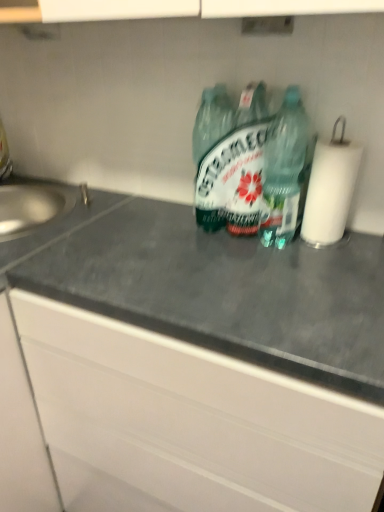
Where is `green glass bottle at center, positioned as the 1th bottle in left-to-right order`? green glass bottle at center, positioned as the 1th bottle in left-to-right order is located at coordinates (262, 174).

In order to face gray matte countertop at center, should I rotate leftwards or rightwards?

Turn right approximately 4.121 degrees to face it.

At what (x,y) coordinates should I click in order to perform the action: click on gray matte countertop at center. Please return your answer as a coordinate pair (x, y). This screenshot has width=384, height=512. Looking at the image, I should click on (217, 288).

You are a GUI agent. You are given a task and a screenshot of the screen. Output one action in this format:
    pyautogui.click(x=<x>, y=<y>)
    Task: Click on the satin silver sink at left
    The height and width of the screenshot is (512, 384).
    Given the screenshot: What is the action you would take?
    pyautogui.click(x=34, y=206)

From the image's perspective, which one is positioned higher, white paper at right or satin silver sink at left?

white paper at right is shown above in the image.

Could you tell me if white paper at right is facing satin silver sink at left?

No, white paper at right does not turn towards satin silver sink at left.

In terms of width, does white paper at right look wider or thinner when compared to satin silver sink at left?

Considering their sizes, white paper at right looks slimmer than satin silver sink at left.

Does gray matte countertop at center have a greater width compared to satin silver sink at left?

Indeed, gray matte countertop at center has a greater width compared to satin silver sink at left.

Is gray matte countertop at center oriented towards satin silver sink at left?

No.

In the scene shown: Is gray matte countertop at center taller or shorter than satin silver sink at left?

In the image, gray matte countertop at center appears to be taller than satin silver sink at left.

Is gray matte countertop at center in contact with satin silver sink at left?

There is a gap between gray matte countertop at center and satin silver sink at left.

Locate an element on the screen. The image size is (384, 512). bottle that is the 1st object located above the gray matte countertop at center (from the image's perspective) is located at coordinates (284, 170).

What's the angular difference between gray matte countertop at center and green translucent bottle at center, which appears as the second bottle when viewed from the left,'s facing directions?

They differ by 0.978 degrees in their facing directions.

In the scene shown: Could you tell me if gray matte countertop at center is facing green translucent bottle at center, which appears as the second bottle when viewed from the left?

No, gray matte countertop at center is not turned towards green translucent bottle at center, which appears as the second bottle when viewed from the left.

From a real-world perspective, which is physically above, green translucent bottle at center, which is the 1th bottle from right to left, or white paper at right?

From a 3D spatial view, green translucent bottle at center, which is the 1th bottle from right to left, is above.

Is green translucent bottle at center, which is the 1th bottle from right to left, at the left side of white paper at right?

Indeed, green translucent bottle at center, which is the 1th bottle from right to left, is positioned on the left side of white paper at right.

Are green translucent bottle at center, which appears as the second bottle when viewed from the left, and white paper at right making contact?

Yes.

Is green translucent bottle at center, which appears as the second bottle when viewed from the left, behind white paper at right?

No.

What are the coordinates of `bottle in front of the green glass bottle at center, positioned as the 1th bottle in left-to-right order` in the screenshot? It's located at (284, 170).

Do you think green glass bottle at center, which is the second bottle in right-to-left order, is within green translucent bottle at center, which appears as the second bottle when viewed from the left, or outside of it?

A: green glass bottle at center, which is the second bottle in right-to-left order, is not inside green translucent bottle at center, which appears as the second bottle when viewed from the left, it's outside.

From a real-world perspective, is green glass bottle at center, which is the second bottle in right-to-left order, positioned above or below green translucent bottle at center, which is the 1th bottle from right to left?

Clearly, from a real-world perspective, green glass bottle at center, which is the second bottle in right-to-left order, is above green translucent bottle at center, which is the 1th bottle from right to left.

From the image's perspective, between green glass bottle at center, which is the second bottle in right-to-left order, and green translucent bottle at center, which appears as the second bottle when viewed from the left, which one is located above?

green glass bottle at center, which is the second bottle in right-to-left order, from the image's perspective.

Is white paper at right wider than green translucent bottle at center, which is the 1th bottle from right to left?

Correct, the width of white paper at right exceeds that of green translucent bottle at center, which is the 1th bottle from right to left.

From a real-world perspective, is white paper at right located beneath green translucent bottle at center, which appears as the second bottle when viewed from the left?

Yes, from a real-world perspective, white paper at right is under green translucent bottle at center, which appears as the second bottle when viewed from the left.

How different are the orientations of white paper at right and green translucent bottle at center, which appears as the second bottle when viewed from the left, in degrees?

4.68 degrees.

Can you see white paper at right touching green translucent bottle at center, which is the 1th bottle from right to left?

Yes, white paper at right is right next to green translucent bottle at center, which is the 1th bottle from right to left, and making contact.

In the scene shown: From the image's perspective, which one is positioned higher, white paper at right or green glass bottle at center, which is the second bottle in right-to-left order?

green glass bottle at center, which is the second bottle in right-to-left order.

Does white paper at right have a larger size compared to green glass bottle at center, which is the second bottle in right-to-left order?

No, white paper at right is not bigger than green glass bottle at center, which is the second bottle in right-to-left order.

Does white paper at right turn towards green glass bottle at center, which is the second bottle in right-to-left order?

No, white paper at right is not facing towards green glass bottle at center, which is the second bottle in right-to-left order.

Locate an element on the screen. The width and height of the screenshot is (384, 512). paper towel on the right side of satin silver sink at left is located at coordinates (330, 188).

Where is `counter top that appears below the satin silver sink at left (from a real-world perspective)`? The height and width of the screenshot is (512, 384). counter top that appears below the satin silver sink at left (from a real-world perspective) is located at coordinates (217, 288).

Estimate the real-world distances between objects in this image. Which object is closer to satin silver sink at left, green translucent bottle at center, which appears as the second bottle when viewed from the left, or green glass bottle at center, which is the second bottle in right-to-left order?

green glass bottle at center, which is the second bottle in right-to-left order, lies closer to satin silver sink at left than the other object.

When comparing their distances from green translucent bottle at center, which appears as the second bottle when viewed from the left, does gray matte countertop at center or green glass bottle at center, positioned as the 1th bottle in left-to-right order, seem closer?

Based on the image, green glass bottle at center, positioned as the 1th bottle in left-to-right order, appears to be nearer to green translucent bottle at center, which appears as the second bottle when viewed from the left.

Based on their spatial positions, is satin silver sink at left or green translucent bottle at center, which appears as the second bottle when viewed from the left, further from gray matte countertop at center?

satin silver sink at left is positioned further to the anchor gray matte countertop at center.

Estimate the real-world distances between objects in this image. Which object is further from green translucent bottle at center, which is the 1th bottle from right to left, white paper at right or satin silver sink at left?

satin silver sink at left lies further to green translucent bottle at center, which is the 1th bottle from right to left, than the other object.

Which object lies further to the anchor point green glass bottle at center, positioned as the 1th bottle in left-to-right order, green translucent bottle at center, which is the 1th bottle from right to left, or satin silver sink at left?

satin silver sink at left is positioned further to the anchor green glass bottle at center, positioned as the 1th bottle in left-to-right order.

Considering their positions, is satin silver sink at left positioned closer to green translucent bottle at center, which is the 1th bottle from right to left, than white paper at right?

white paper at right.

When comparing their distances from green glass bottle at center, positioned as the 1th bottle in left-to-right order, does green translucent bottle at center, which appears as the second bottle when viewed from the left, or gray matte countertop at center seem further?

Among the two, gray matte countertop at center is located further to green glass bottle at center, positioned as the 1th bottle in left-to-right order.

Which object lies further to the anchor point gray matte countertop at center, green glass bottle at center, positioned as the 1th bottle in left-to-right order, or satin silver sink at left?

satin silver sink at left.

Image resolution: width=384 pixels, height=512 pixels. I want to click on bottle that lies between green glass bottle at center, which is the second bottle in right-to-left order, and gray matte countertop at center from top to bottom, so click(x=284, y=170).

Locate an element on the screen. sink between green glass bottle at center, positioned as the 1th bottle in left-to-right order, and gray matte countertop at center, in the vertical direction is located at coordinates (34, 206).

I want to click on counter top between satin silver sink at left and white paper at right, so click(x=217, y=288).

Identify the location of paper towel between green glass bottle at center, positioned as the 1th bottle in left-to-right order, and gray matte countertop at center vertically. (330, 188).